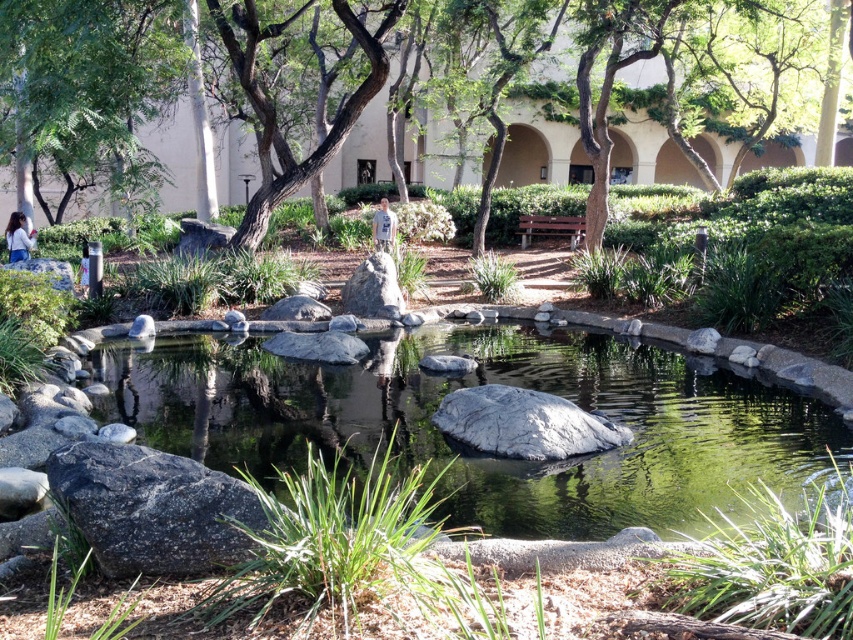
You are standing at the entrance of the building in the background and want to walk directly towards the green leafy tree at center. Which direction should you head?

The green leafy tree at center is located at point (x=80, y=68), so you should head towards the lower left direction from the building to reach it.

You are a gardener who needs to place a 6.5 feet long decorative fence between the smooth gray rock at center and the gray rough rock at lower left. Can you fit the fence between them without bending it?

The distance between the smooth gray rock at center and the gray rough rock at lower left is 6.80 feet. Since the fence is 6.5 feet long, it can fit between them without bending.

You are standing at the edge of the pond and want to walk towards the building in the background. Which rock should you step on first, the smooth gray rock at center or the gray rough rock at lower left?

You should step on the smooth gray rock at center first because it is closer to you than the gray rough rock at lower left, which is further away.